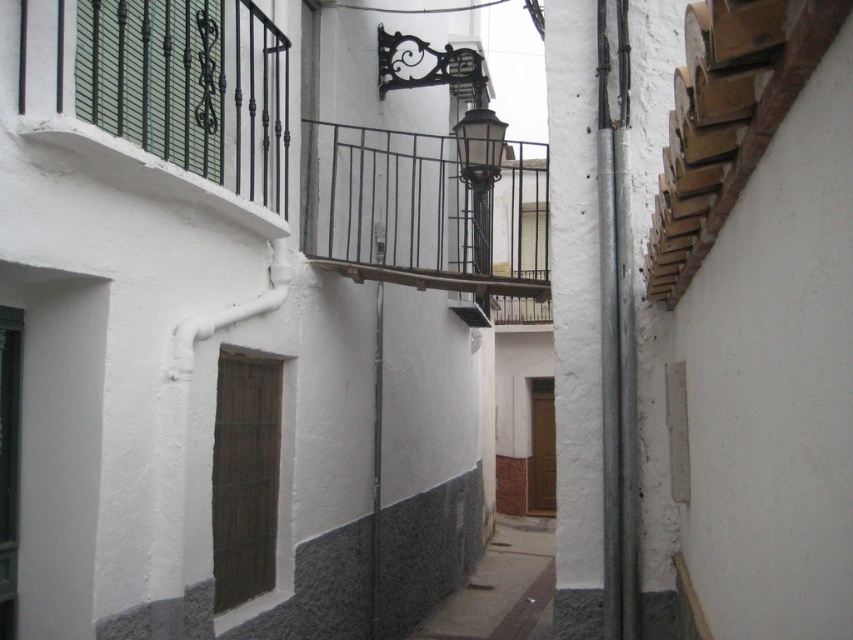
You are standing at the point labeled point (x=149, y=99). You want to walk to the streetlamp mounted on the wall above the balcony. How far will you have to walk?

The distance between point (x=149, y=99) and the streetlamp mounted on the wall above the balcony is 5.67 meters, so you will have to walk 5.67 meters to reach it.

You are standing in the narrow alleyway between two white buildings. You see two points marked on the ground. The first point is at coordinates point (38, 10) and the second point is at point (495, 218). Which point is closer to you as you face the alley?

Point (38, 10) is in front of point (495, 218), so it is closer to you as you face the alley.

You are a painter standing in the alleyway between the two buildings. You want to paint both the black wrought iron balcony at upper left and the brown wooden tiles at upper right. If your ladder can reach up to 2.5 meters, can you safely paint both objects without moving the ladder?

The black wrought iron balcony at upper left and brown wooden tiles at upper right are 2.46 meters apart from each other. Since your ladder can reach up to 2.5 meters, you can safely paint both objects without moving the ladder as the distance between them is within the ladder reach.